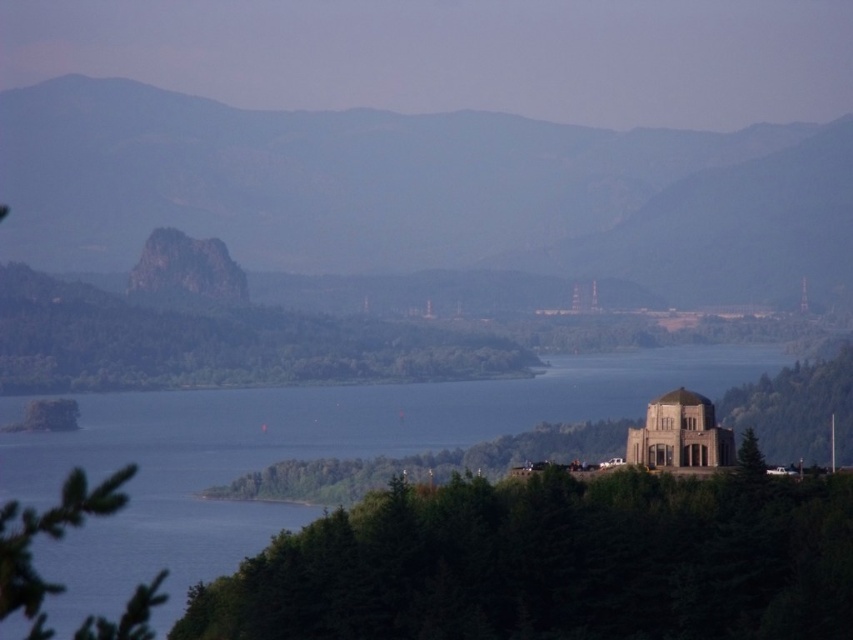
Question: Can you confirm if rugged granite rock at center is positioned below blue water at center?

Choices:
 (A) yes
 (B) no

Answer: (B)

Question: Which of the following is the farthest from the observer?

Choices:
 (A) blue water at center
 (B) rugged granite rock at center

Answer: (B)

Question: Which object is farther from the camera taking this photo?

Choices:
 (A) rugged granite rock at center
 (B) blue water at center

Answer: (A)

Question: Does rugged granite rock at center appear on the left side of blue water at center?

Choices:
 (A) no
 (B) yes

Answer: (A)

Question: Which object appears farthest from the camera in this image?

Choices:
 (A) blue water at center
 (B) rugged granite rock at center

Answer: (B)

Question: Does rugged granite rock at center have a smaller size compared to blue water at center?

Choices:
 (A) no
 (B) yes

Answer: (B)